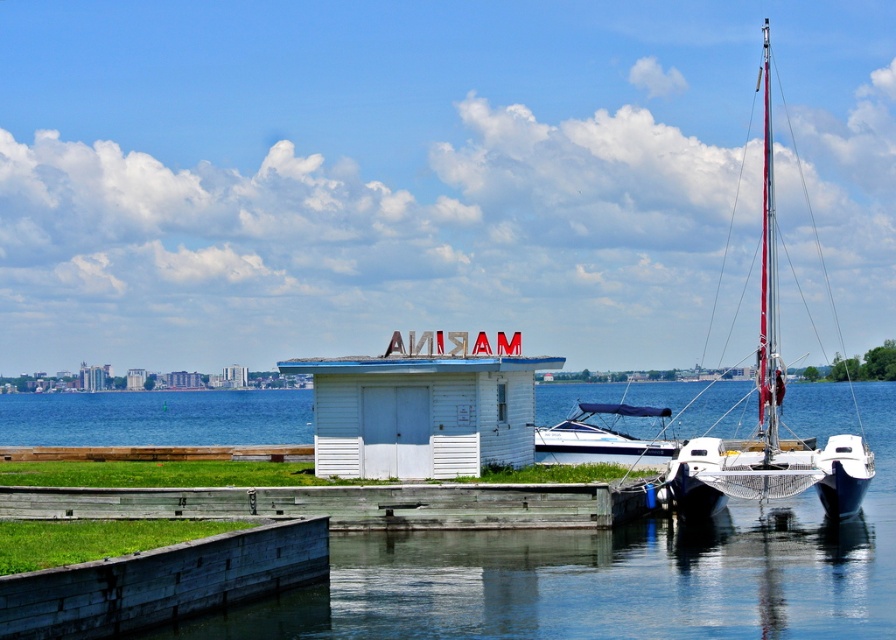
Question: Observing the image, what is the correct spatial positioning of metallic silver sailboat at right in reference to blue water at lower left?

Choices:
 (A) below
 (B) above

Answer: (B)

Question: In this image, where is wooden dock at lower center located relative to metallic silver sailboat at right?

Choices:
 (A) right
 (B) left

Answer: (B)

Question: Which object appears closest to the camera in this image?

Choices:
 (A) white plastic boat at center
 (B) metallic silver sailboat at right
 (C) blue water at lower left
 (D) wooden dock at lower center

Answer: (D)

Question: Which of these objects is positioned farthest from the wooden dock at lower center?

Choices:
 (A) white plastic boat at center
 (B) metallic silver sailboat at right
 (C) blue water at lower left

Answer: (C)

Question: Does metallic silver sailboat at right appear under white plastic boat at center?

Choices:
 (A) no
 (B) yes

Answer: (A)

Question: Which object is farther from the camera taking this photo?

Choices:
 (A) wooden dock at lower center
 (B) white plastic boat at center
 (C) blue water at lower left

Answer: (C)